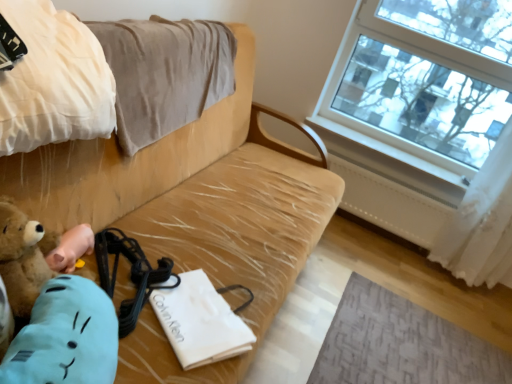
You are a GUI agent. You are given a task and a screenshot of the screen. Output one action in this format:
    pyautogui.click(x=<x>, y=<y>)
    Task: Click on the free region under white sheer curtain at right (from a real-world perspective)
    Image resolution: width=512 pixels, height=384 pixels.
    Given the screenshot: What is the action you would take?
    pyautogui.click(x=447, y=274)